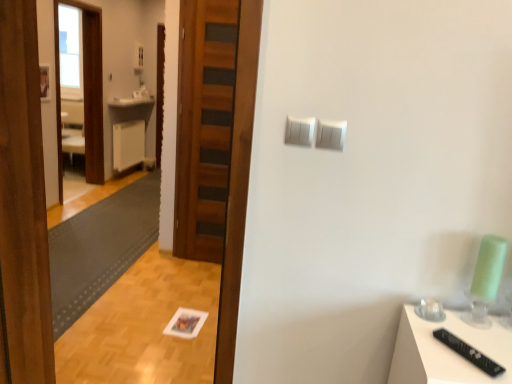
Question: Is the depth of white plastic light switch at upper center, which is the 2th light switch in right-to-left order, greater than that of dark gray textured mat at lower left?

Choices:
 (A) no
 (B) yes

Answer: (A)

Question: Does white plastic light switch at upper center, positioned as the 1th light switch in left-to-right order, appear on the right side of dark gray textured mat at lower left?

Choices:
 (A) yes
 (B) no

Answer: (A)

Question: Does white plastic light switch at upper center, positioned as the 1th light switch in left-to-right order, lie in front of dark gray textured mat at lower left?

Choices:
 (A) no
 (B) yes

Answer: (B)

Question: Can you confirm if white plastic light switch at upper center, which is the 2th light switch in right-to-left order, is bigger than dark gray textured mat at lower left?

Choices:
 (A) yes
 (B) no

Answer: (B)

Question: Considering the relative sizes of white plastic light switch at upper center, positioned as the 1th light switch in left-to-right order, and dark gray textured mat at lower left in the image provided, is white plastic light switch at upper center, positioned as the 1th light switch in left-to-right order, smaller than dark gray textured mat at lower left?

Choices:
 (A) yes
 (B) no

Answer: (A)

Question: Is white plastic light switch at upper center, which is the 2th light switch in right-to-left order, facing towards dark gray textured mat at lower left?

Choices:
 (A) yes
 (B) no

Answer: (B)

Question: Can we say dark gray textured mat at lower left lies outside wooden screen door at left?

Choices:
 (A) no
 (B) yes

Answer: (B)

Question: From the image's perspective, does dark gray textured mat at lower left appear lower than wooden screen door at left?

Choices:
 (A) yes
 (B) no

Answer: (A)

Question: Can you confirm if dark gray textured mat at lower left is taller than wooden screen door at left?

Choices:
 (A) yes
 (B) no

Answer: (B)

Question: Considering the relative positions of dark gray textured mat at lower left and wooden screen door at left in the image provided, is dark gray textured mat at lower left in front of wooden screen door at left?

Choices:
 (A) yes
 (B) no

Answer: (A)

Question: Does dark gray textured mat at lower left have a smaller size compared to wooden screen door at left?

Choices:
 (A) yes
 (B) no

Answer: (A)

Question: Is dark gray textured mat at lower left behind wooden screen door at left?

Choices:
 (A) no
 (B) yes

Answer: (A)

Question: From the image's perspective, is white glossy counter top at center over wooden door at center?

Choices:
 (A) no
 (B) yes

Answer: (B)